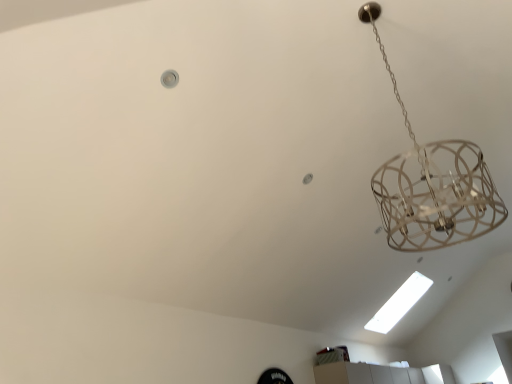
Question: From a real-world perspective, is metallic wire chandelier at upper right physically located above or below white fluorescent light at upper center?

Choices:
 (A) above
 (B) below

Answer: (A)

Question: From the image's perspective, is metallic wire chandelier at upper right located above or below white fluorescent light at upper center?

Choices:
 (A) above
 (B) below

Answer: (A)

Question: From their relative heights in the image, would you say metallic wire chandelier at upper right is taller or shorter than white fluorescent light at upper center?

Choices:
 (A) tall
 (B) short

Answer: (B)

Question: Considering the positions of white fluorescent light at upper center and metallic wire chandelier at upper right in the image, is white fluorescent light at upper center taller or shorter than metallic wire chandelier at upper right?

Choices:
 (A) short
 (B) tall

Answer: (B)

Question: From a real-world perspective, is white fluorescent light at upper center positioned above or below metallic wire chandelier at upper right?

Choices:
 (A) above
 (B) below

Answer: (B)

Question: Is white fluorescent light at upper center wider or thinner than metallic wire chandelier at upper right?

Choices:
 (A) thin
 (B) wide

Answer: (A)

Question: Is white fluorescent light at upper center situated inside metallic wire chandelier at upper right or outside?

Choices:
 (A) outside
 (B) inside

Answer: (A)